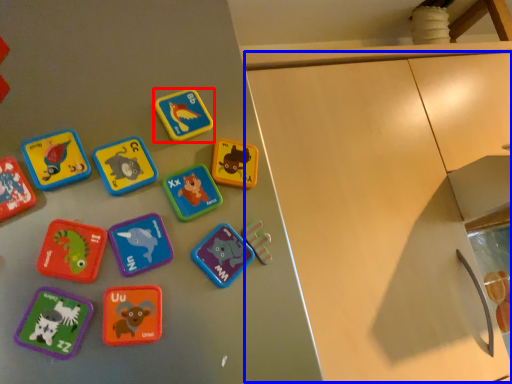
Question: Which of the following is the farthest to the observer, toy (highlighted by a red box) or cabinetry (highlighted by a blue box)?

Choices:
 (A) toy
 (B) cabinetry

Answer: (B)